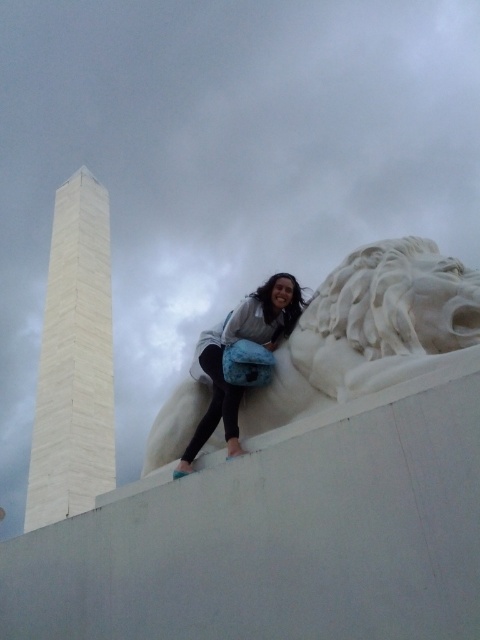
You are a photographer setting up a tripod between the white marble lion head at upper center and the matte white statue at upper center. The tripod requires a minimum of 3 meters of space between the two objects to capture both in frame. Can you set up your tripod here?

The white marble lion head at upper center is 3.49 meters away from the matte white statue at upper center, so yes, the tripod can be set up between them as the distance meets the minimum requirement of 3 meters.

You are standing in front of a monument with a lion statue. The lion statue has a head at a specific location. If you look at the lion statue, where would you find the white marble lion head at upper center relative to the statue?

The white marble lion head at upper center is located at point (370, 332) on the statue.